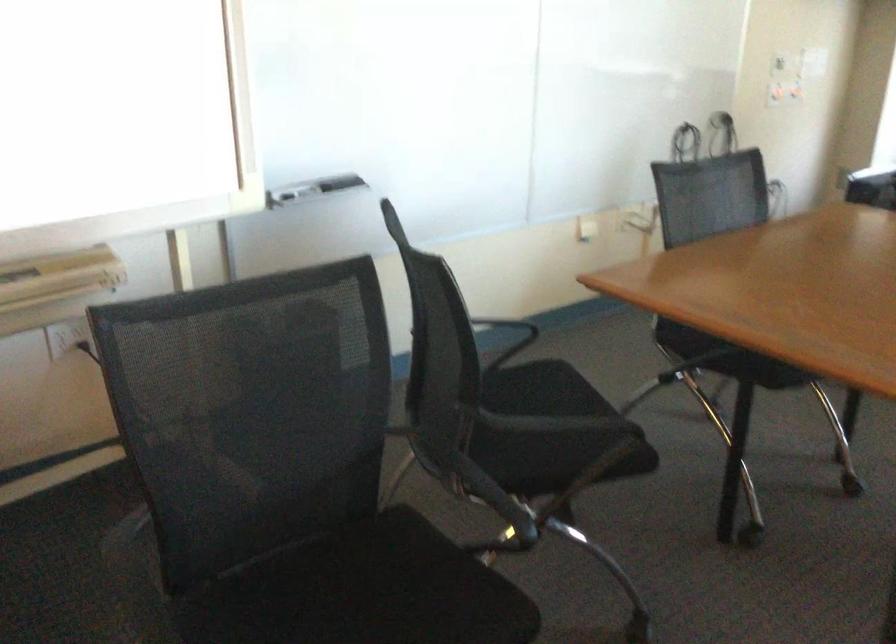
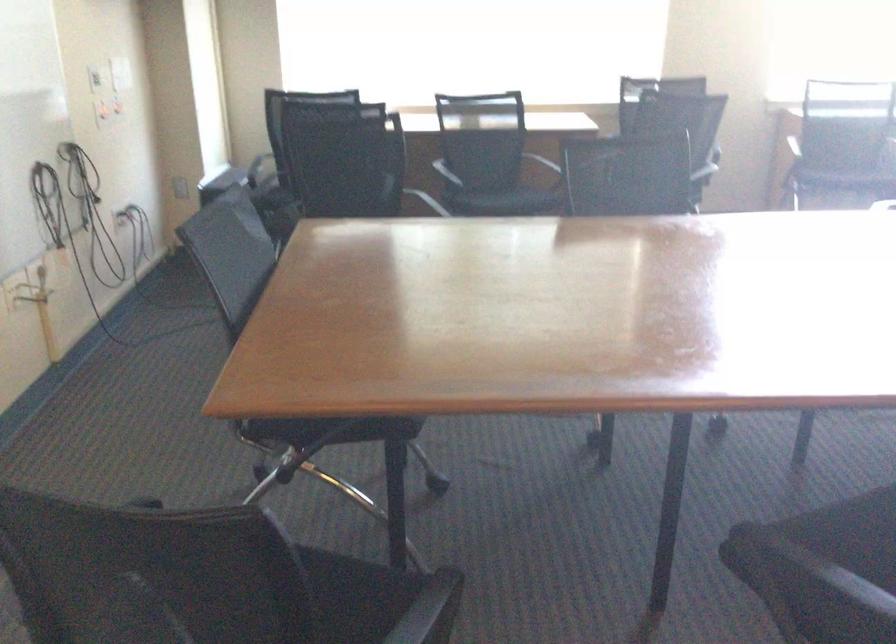
Question: Based on the continuous images, in which direction is the camera rotating? Reply with the corresponding letter.

Choices:
 (A) Left
 (B) Right
 (C) Up
 (D) Down

Answer: (B)